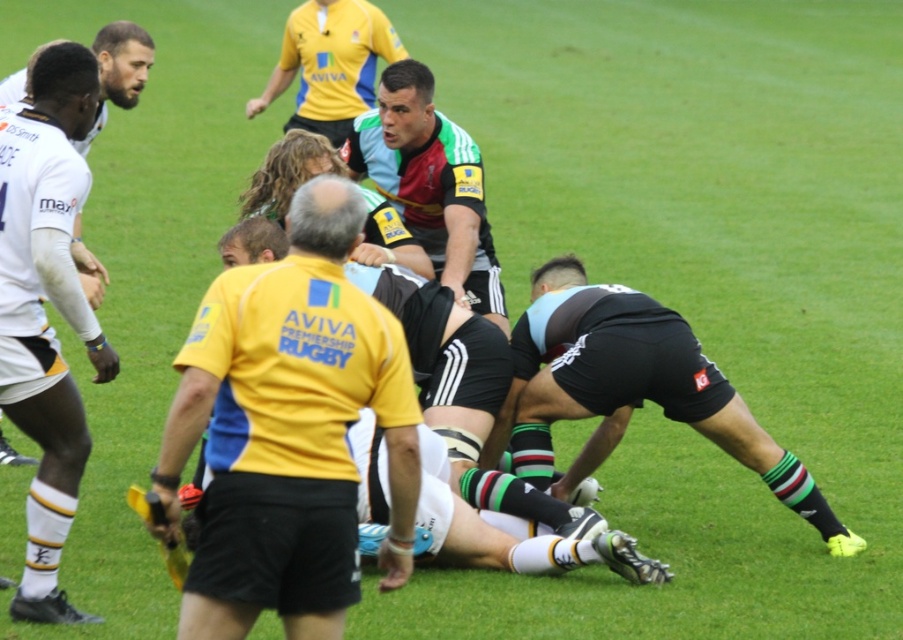
Question: Is yellow jersey at center to the left of white matte jersey at upper left from the viewer's perspective?

Choices:
 (A) no
 (B) yes

Answer: (A)

Question: Which object appears closest to the camera in this image?

Choices:
 (A) yellow jersey at center
 (B) light blue jersey at center

Answer: (A)

Question: Which object is farther from the camera taking this photo?

Choices:
 (A) light blue jersey at center
 (B) white matte jersey at left
 (C) white matte jersey at upper left

Answer: (A)

Question: Is maroon jersey at center closer to camera compared to light blue jersey at center?

Choices:
 (A) yes
 (B) no

Answer: (A)

Question: Considering the real-world distances, which object is farthest from the white matte jersey at left?

Choices:
 (A) maroon jersey at center
 (B) white matte jersey at upper left

Answer: (A)

Question: Does maroon jersey at center have a greater width compared to light blue jersey at center?

Choices:
 (A) yes
 (B) no

Answer: (B)